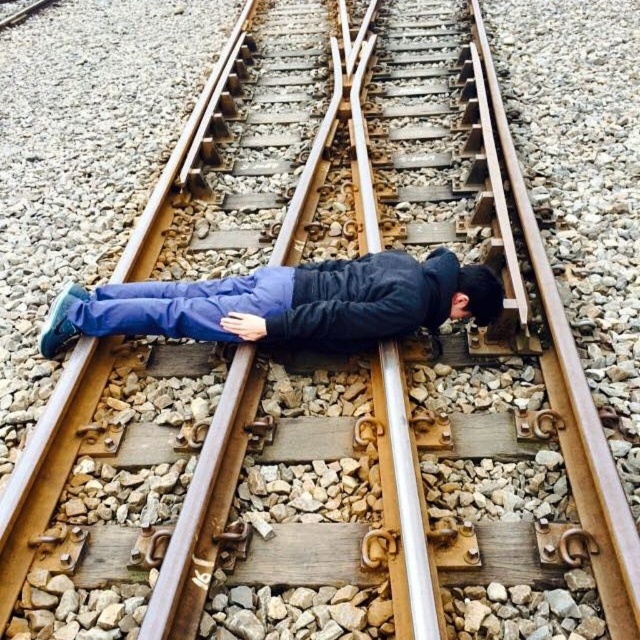
Is blue fabric pants at center shorter than black matte hair at center?

No, blue fabric pants at center is not shorter than black matte hair at center.

Between point (227, 337) and point (497, 276), which one is positioned in front?

Positioned in front is point (227, 337).

Locate an element on the screen. This screenshot has width=640, height=640. blue fabric pants at center is located at coordinates (288, 304).